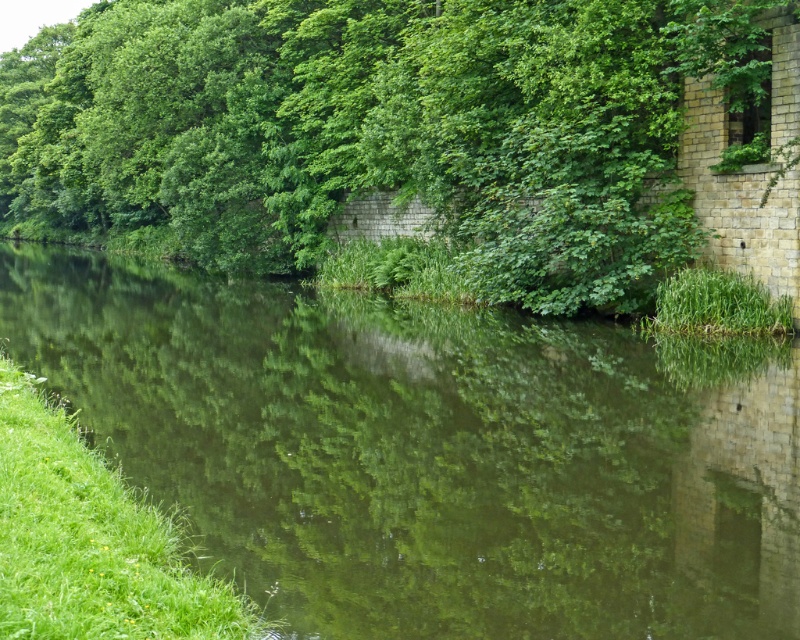
Question: Is green reflective water at center further to camera compared to green leafy tree at upper left?

Choices:
 (A) no
 (B) yes

Answer: (A)

Question: Is green reflective water at center wider than green leafy tree at upper left?

Choices:
 (A) no
 (B) yes

Answer: (A)

Question: Which point is farther to the camera?

Choices:
 (A) (300, 54)
 (B) (664, 552)

Answer: (A)

Question: Which of the following is the farthest from the observer?

Choices:
 (A) green reflective water at center
 (B) green leafy tree at upper left

Answer: (B)

Question: Can you confirm if green reflective water at center is positioned to the left of green leafy tree at upper left?

Choices:
 (A) yes
 (B) no

Answer: (B)

Question: Which of the following is the farthest from the observer?

Choices:
 (A) green reflective water at center
 (B) green leafy tree at upper left

Answer: (B)